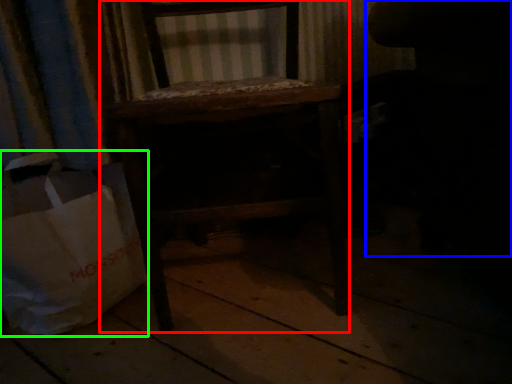
Question: Considering the real-world distances, which object is farthest from furniture (highlighted by a red box)? swivel chair (highlighted by a blue box) or grocery bag (highlighted by a green box)?

Choices:
 (A) swivel chair
 (B) grocery bag

Answer: (A)